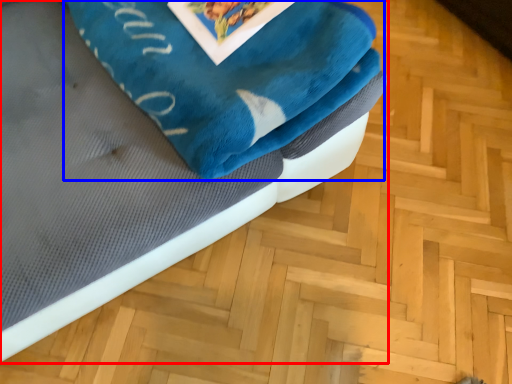
Question: Which of the following is the farthest to the observer, furniture (highlighted by a red box) or bath towel (highlighted by a blue box)?

Choices:
 (A) furniture
 (B) bath towel

Answer: (B)